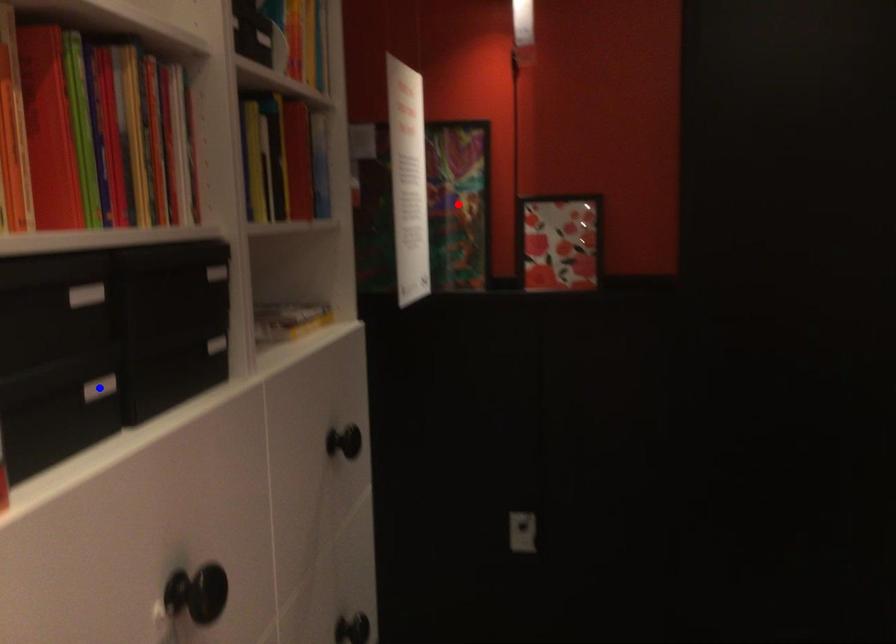
Question: Two points are marked on the image. Which point is closer to the camera?

Choices:
 (A) Blue point is closer.
 (B) Red point is closer.

Answer: (A)